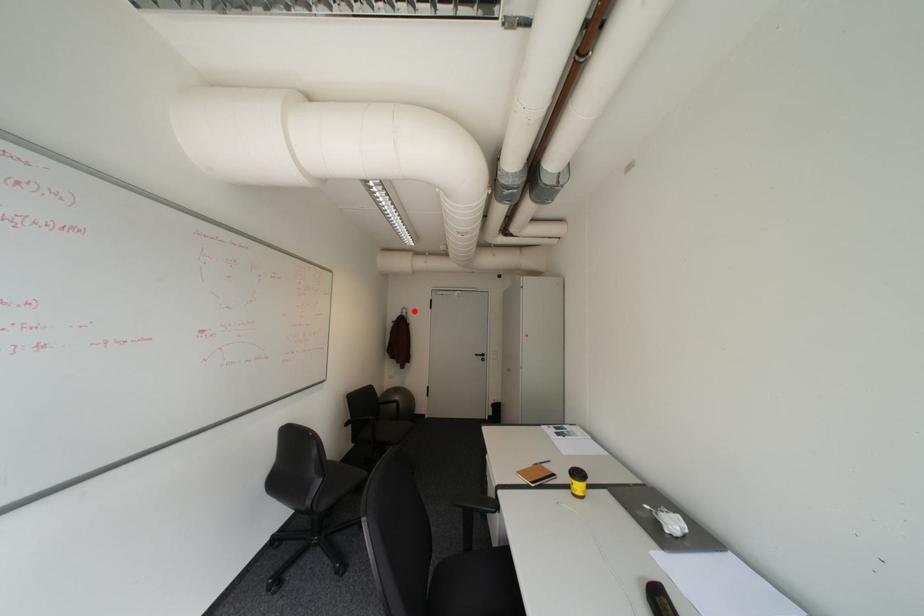
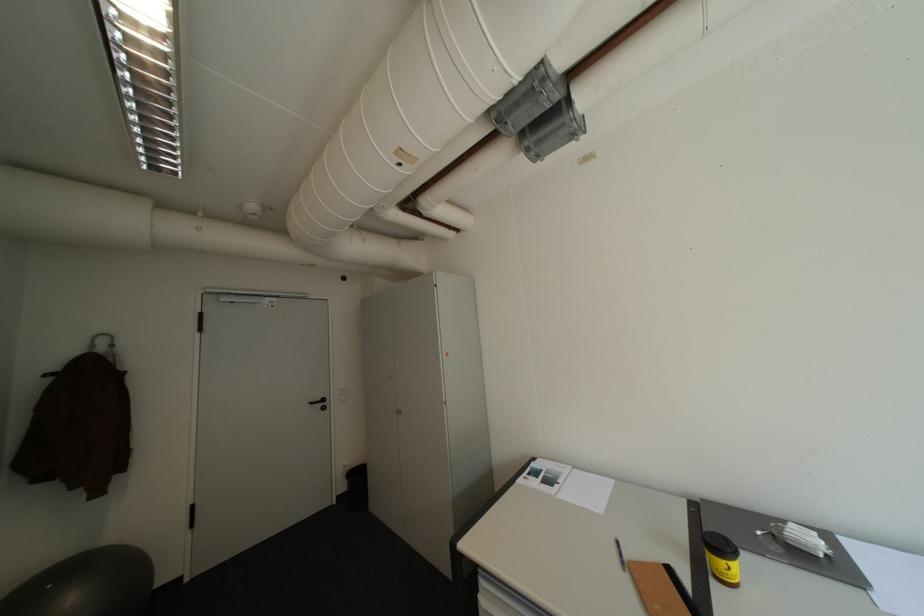
Question: I am providing you with two images of the same scene from different viewpoints. A red point is marked on the first image. Can you still see the location of the red point in image 2?

Choices:
 (A) Yes
 (B) No

Answer: (A)